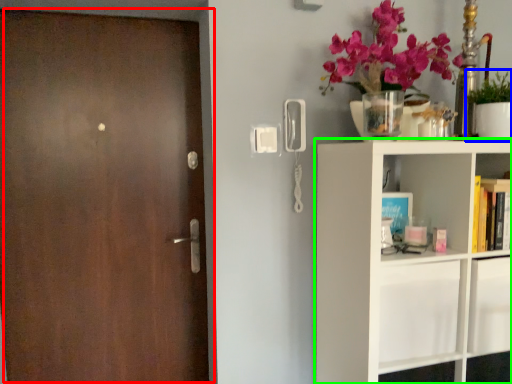
Question: Which object is positioned closest to door (highlighted by a red box)? Select from houseplant (highlighted by a blue box) and shelf (highlighted by a green box).

Choices:
 (A) houseplant
 (B) shelf

Answer: (B)